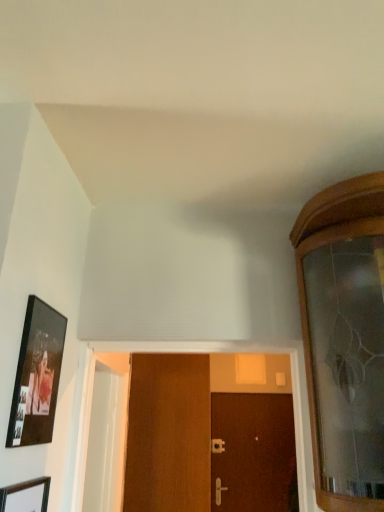
Question: Is wooden door at center, placed as the second door when sorted from back to front, shorter than satin gold door handle at center, acting as the 2th door handle starting from the back?

Choices:
 (A) yes
 (B) no

Answer: (B)

Question: Is wooden door at center, which is the first door in top-to-bottom order, positioned with its back to satin gold door handle at center, acting as the 2th door handle starting from the back?

Choices:
 (A) yes
 (B) no

Answer: (A)

Question: Is wooden door at center, which is counted as the first door, starting from the left, to the left of satin gold door handle at center, acting as the 2th door handle starting from the back, from the viewer's perspective?

Choices:
 (A) yes
 (B) no

Answer: (A)

Question: Can you confirm if wooden door at center, which is counted as the first door, starting from the left, is smaller than satin gold door handle at center, which is the second door handle from top to bottom?

Choices:
 (A) yes
 (B) no

Answer: (B)

Question: Is wooden door at center, which ranks as the second door in right-to-left order, facing towards satin gold door handle at center, arranged as the 1th door handle when ordered from the bottom?

Choices:
 (A) no
 (B) yes

Answer: (A)

Question: Is matte black picture frame at left, which ranks as the 2th picture frame in bottom-to-top order, inside the boundaries of satin gold door handle at center, which is the second door handle from top to bottom, or outside?

Choices:
 (A) inside
 (B) outside

Answer: (B)

Question: From the image's perspective, is matte black picture frame at left, which ranks as the 2th picture frame in bottom-to-top order, positioned above or below satin gold door handle at center, which is the 1th door handle from front to back?

Choices:
 (A) above
 (B) below

Answer: (A)

Question: Is point (16, 379) positioned closer to the camera than point (216, 496)?

Choices:
 (A) closer
 (B) farther

Answer: (A)

Question: In the image, is matte black picture frame at left, which ranks as the 2th picture frame in bottom-to-top order, on the left side or the right side of satin gold door handle at center, which is the second door handle from top to bottom?

Choices:
 (A) right
 (B) left

Answer: (B)

Question: Looking at the image, does silver metallic door handle at center, which appears as the 1th door handle when viewed from the back, seem bigger or smaller compared to matte black picture frame at left, which ranks as the 2th picture frame in bottom-to-top order?

Choices:
 (A) big
 (B) small

Answer: (B)

Question: From the image's perspective, is silver metallic door handle at center, the second door handle ordered from the bottom, positioned above or below matte black picture frame at left, acting as the first picture frame starting from the top?

Choices:
 (A) above
 (B) below

Answer: (B)

Question: Which is correct: silver metallic door handle at center, acting as the second door handle starting from the front, is inside matte black picture frame at left, acting as the first picture frame starting from the top, or outside of it?

Choices:
 (A) inside
 (B) outside

Answer: (B)

Question: Is silver metallic door handle at center, acting as the second door handle starting from the front, wider or thinner than matte black picture frame at left, acting as the first picture frame starting from the top?

Choices:
 (A) wide
 (B) thin

Answer: (A)

Question: From a real-world perspective, relative to brown wooden door at center, the 1th door positioned from the bottom, is wooden picture frame at lower left, placed as the first picture frame when sorted from bottom to top, vertically above or below?

Choices:
 (A) above
 (B) below

Answer: (B)

Question: Which is correct: wooden picture frame at lower left, placed as the first picture frame when sorted from bottom to top, is inside brown wooden door at center, arranged as the 1th door when viewed from the back, or outside of it?

Choices:
 (A) outside
 (B) inside

Answer: (A)